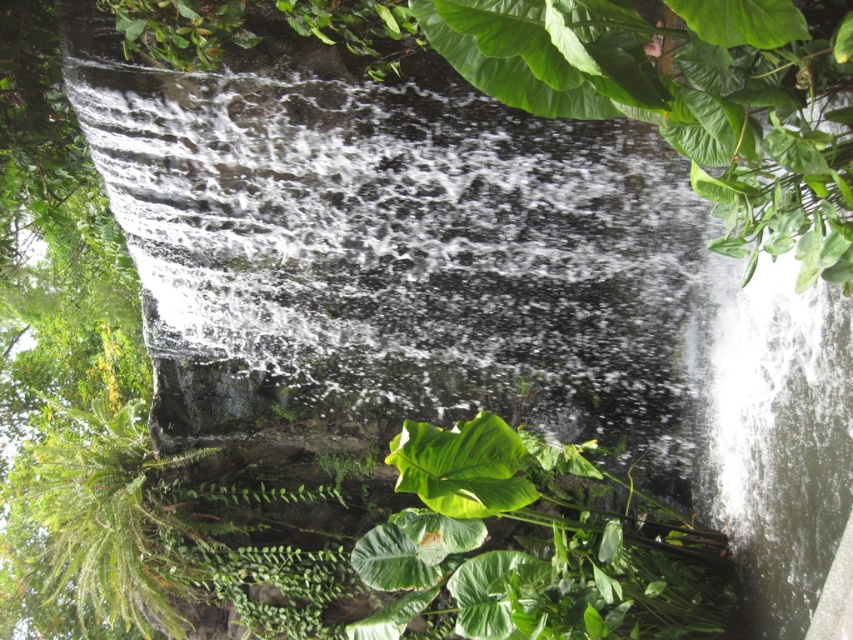
Can you confirm if green leafy plant at center is bigger than green fuzzy fern at lower left?

No, green leafy plant at center is not bigger than green fuzzy fern at lower left.

Who is higher up, green leafy plant at center or green fuzzy fern at lower left?

Positioned higher is green leafy plant at center.

Which is in front, point (436, 522) or point (152, 609)?

Point (436, 522)

Identify the location of green leafy plant at center. The height and width of the screenshot is (640, 853). (532, 547).